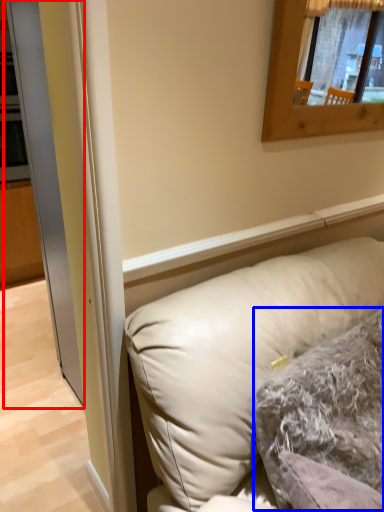
Question: Which object is closer to the camera taking this photo, glass door (highlighted by a red box) or pillow (highlighted by a blue box)?

Choices:
 (A) glass door
 (B) pillow

Answer: (A)